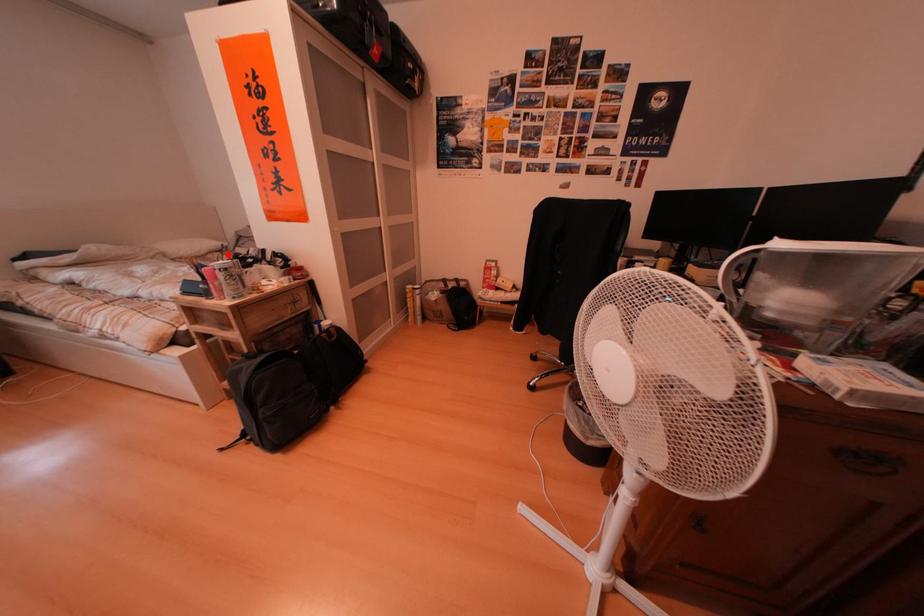
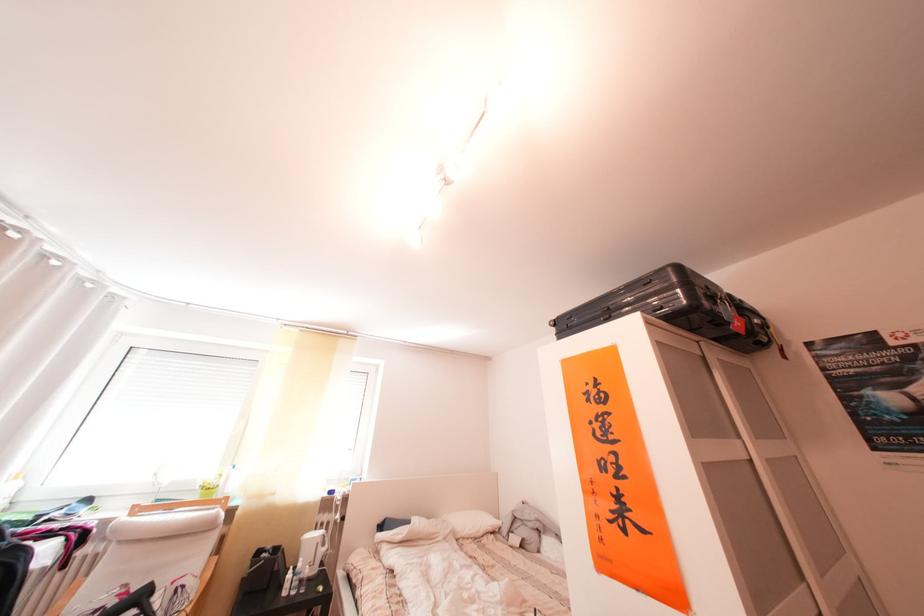
Locate, in the second image, the point that corresponds to the highlighted location in the first image.

(504, 535)